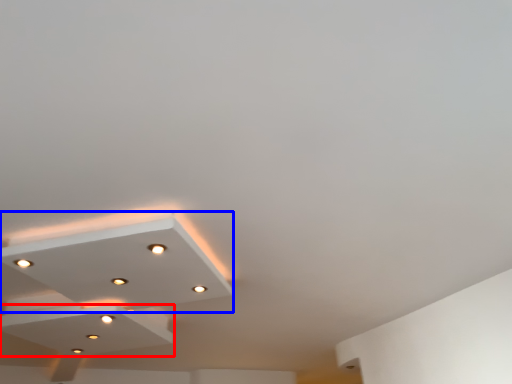
Question: Among these objects, which one is farthest to the camera, exhaust hood (highlighted by a red box) or lamp (highlighted by a blue box)?

Choices:
 (A) exhaust hood
 (B) lamp

Answer: (A)